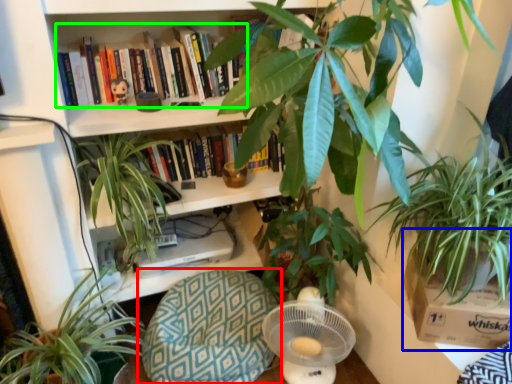
Question: Which is nearer to the swivel chair (highlighted by a red box)? cardboard box (highlighted by a blue box) or book (highlighted by a green box).

Choices:
 (A) cardboard box
 (B) book

Answer: (A)